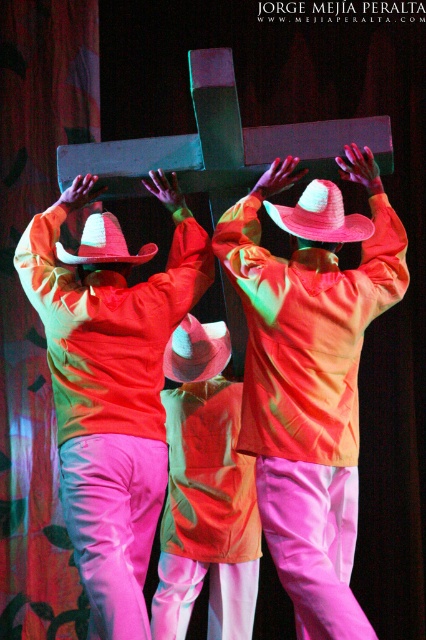
Question: Does pink felt cowboy hat at center appear on the right side of white felt cowboy hat at center?

Choices:
 (A) yes
 (B) no

Answer: (A)

Question: Does pink satin pants at center appear on the left side of white felt cowboy hat at center?

Choices:
 (A) yes
 (B) no

Answer: (B)

Question: Which object is farther from the camera taking this photo?

Choices:
 (A) white felt cowboy hat at center
 (B) pink straw cowboy hat at center

Answer: (A)

Question: Can you confirm if pink satin hat at upper center is positioned below pink felt cowboy hat at center?

Choices:
 (A) no
 (B) yes

Answer: (B)

Question: Which of these objects is positioned closest to the pink felt cowboy hat at center?

Choices:
 (A) pink straw cowboy hat at center
 (B) pink satin hat at upper center
 (C) white felt cowboy hat at center
 (D) pink satin pants at center

Answer: (D)

Question: Which point is farther from the camera taking this photo?

Choices:
 (A) (124, 467)
 (B) (264, 202)
 (C) (149, 257)

Answer: (B)